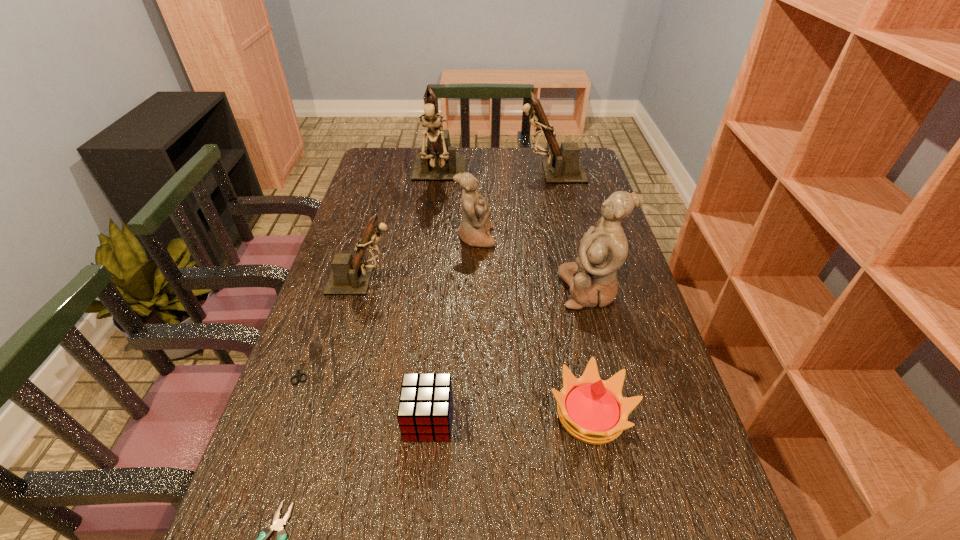
You are a GUI agent. You are given a task and a screenshot of the screen. Output one action in this format:
    pyautogui.click(x=<x>, y=<y>)
    Task: Click on the tallest figurine
    The width and height of the screenshot is (960, 540).
    Given the screenshot: What is the action you would take?
    pyautogui.click(x=438, y=161)

This screenshot has width=960, height=540. Find the location of `the tallest object`. the tallest object is located at coordinates (438, 161).

Where is `the second biggest brown figurine`? the second biggest brown figurine is located at coordinates (565, 167).

What are the coordinates of `the right white figurine` in the screenshot? It's located at (592, 278).

What are the coordinates of `the bigger white figurine` in the screenshot? It's located at (592, 278).

The height and width of the screenshot is (540, 960). In order to click on the smaller white figurine in this screenshot , I will do `click(474, 230)`.

Find the location of `the farther white figurine`. the farther white figurine is located at coordinates 474,230.

Locate an element on the screen. The width and height of the screenshot is (960, 540). the nearest brown figurine is located at coordinates (350, 275).

The image size is (960, 540). Find the location of `the fourth shortest object`. the fourth shortest object is located at coordinates (592, 410).

Where is `crown`? The height and width of the screenshot is (540, 960). crown is located at coordinates (592, 410).